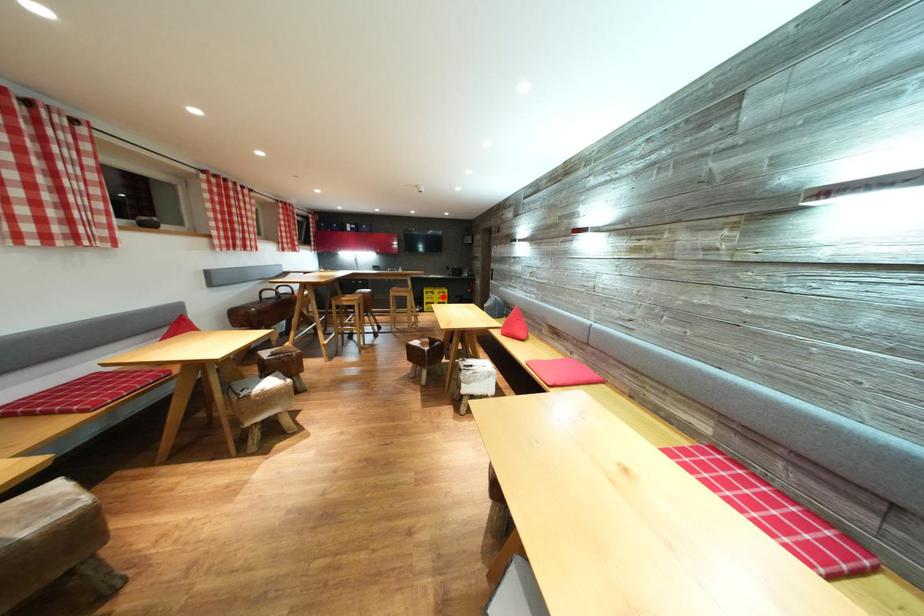
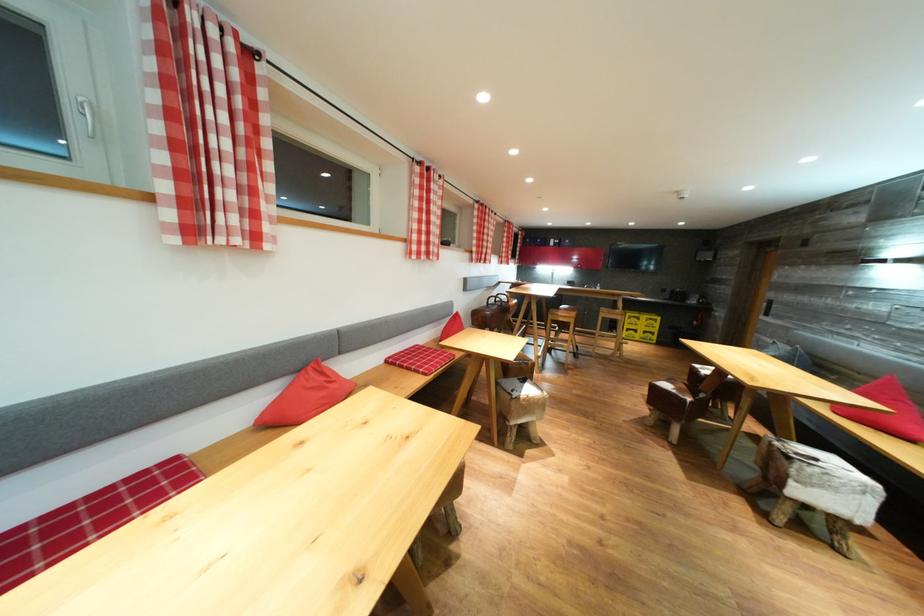
Question: I am providing you with two images of the same scene from different viewpoints. A red point is shown in image1. For the corresponding object point in image2, is it positioned nearer or farther from the camera?

Choices:
 (A) Nearer
 (B) Farther

Answer: (B)